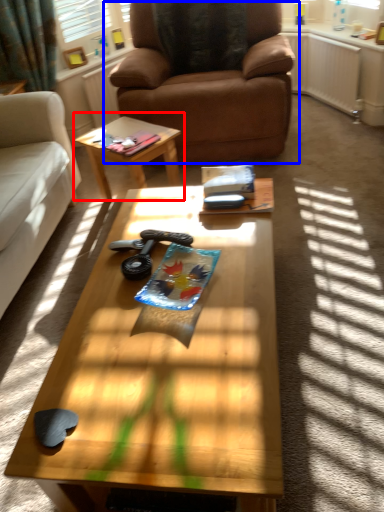
Question: Among these objects, which one is farthest to the camera, coffee table (highlighted by a red box) or chair (highlighted by a blue box)?

Choices:
 (A) coffee table
 (B) chair

Answer: (A)